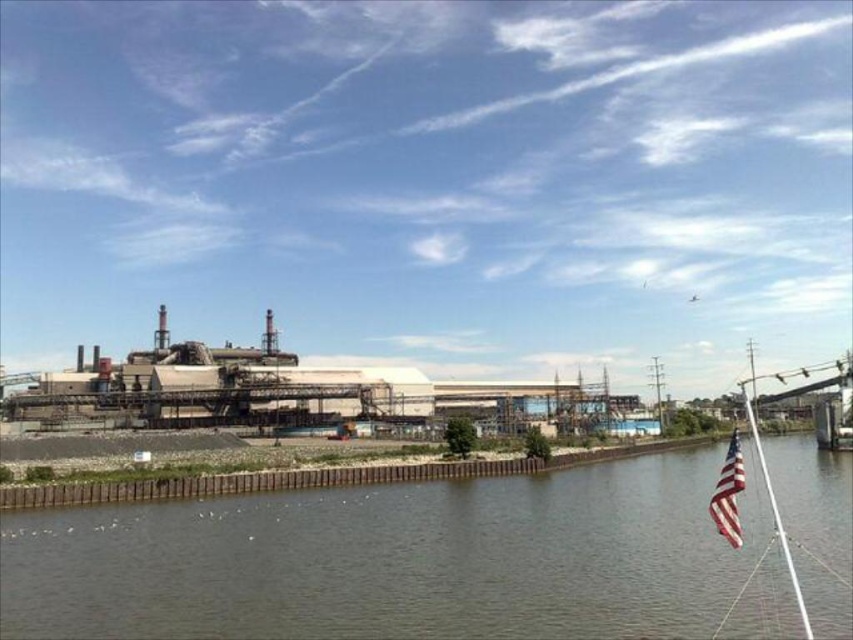
Between brown concrete river at lower center and white plastic mast at right, which one appears on the right side from the viewer's perspective?

white plastic mast at right

Which is above, brown concrete river at lower center or white plastic mast at right?

brown concrete river at lower center is above.

You are a GUI agent. You are given a task and a screenshot of the screen. Output one action in this format:
    pyautogui.click(x=<x>, y=<y>)
    Task: Click on the brown concrete river at lower center
    The height and width of the screenshot is (640, 853).
    Given the screenshot: What is the action you would take?
    pyautogui.click(x=393, y=560)

Consider the image. Can you confirm if american flag at right is taller than white plastic mast at right?

Indeed, american flag at right has a greater height compared to white plastic mast at right.

Between american flag at right and white plastic mast at right, which one appears on the right side from the viewer's perspective?

white plastic mast at right is more to the right.

Does point (734, 545) lie in front of point (654, 356)?

That is True.

Identify the location of american flag at right. The image size is (853, 640). (728, 493).

Which is behind, point (273, 412) or point (657, 376)?

The point (657, 376) is more distant.

Is industrial gray concrete factory at center thinner than white plastic mast at right?

Incorrect, industrial gray concrete factory at center's width is not less than white plastic mast at right's.

Image resolution: width=853 pixels, height=640 pixels. What are the coordinates of `industrial gray concrete factory at center` in the screenshot? It's located at (283, 392).